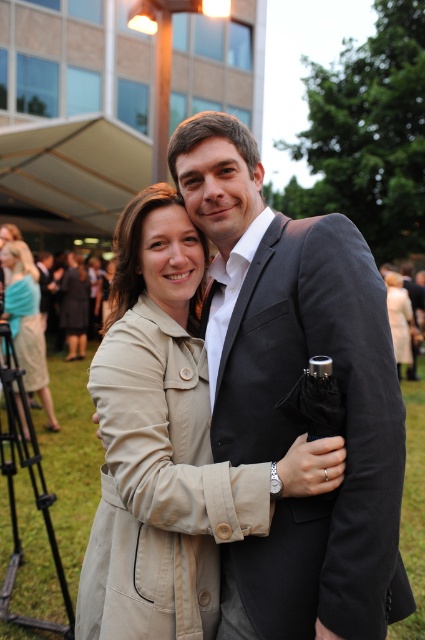
Which is behind, point (113, 621) or point (394, 285)?

The point (394, 285) is behind.

Which of these two, beige fabric coat at center or beige fabric coat at lower right, stands taller?

Standing taller between the two is beige fabric coat at center.

Between point (178, 410) and point (396, 321), which one is positioned in front?

Point (178, 410) is more forward.

Locate an element on the screen. The width and height of the screenshot is (425, 640). beige fabric coat at center is located at coordinates (167, 445).

Is matte black suit at center thinner than beige fabric coat at center?

Yes, matte black suit at center is thinner than beige fabric coat at center.

Does matte black suit at center have a greater width compared to beige fabric coat at center?

In fact, matte black suit at center might be narrower than beige fabric coat at center.

Between point (323, 538) and point (195, 612), which one is positioned in front?

Point (323, 538)

The height and width of the screenshot is (640, 425). What are the coordinates of `matte black suit at center` in the screenshot? It's located at (288, 392).

Between point (28, 259) and point (404, 342), which one is positioned in front?

Point (28, 259) is in front.

Who is higher up, beige trench coat at lower left or beige fabric coat at lower right?

beige fabric coat at lower right is above.

This screenshot has height=640, width=425. What do you see at coordinates (27, 323) in the screenshot?
I see `beige trench coat at lower left` at bounding box center [27, 323].

Identify the location of beige trench coat at lower left. point(27,323).